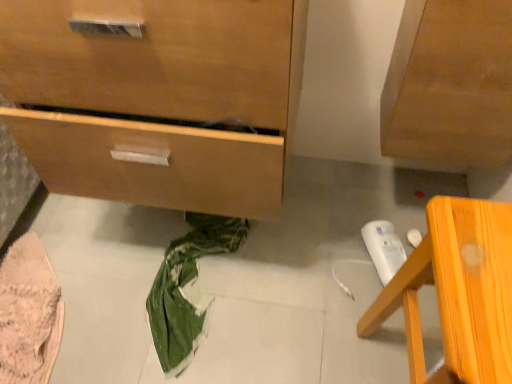
You are a GUI agent. You are given a task and a screenshot of the screen. Output one action in this format:
    pyautogui.click(x=<x>, y=<y>)
    Task: Click on the vacant space behind pink knitted fabric at lower left
    Image resolution: width=512 pixels, height=384 pixels.
    Given the screenshot: What is the action you would take?
    pyautogui.click(x=83, y=220)